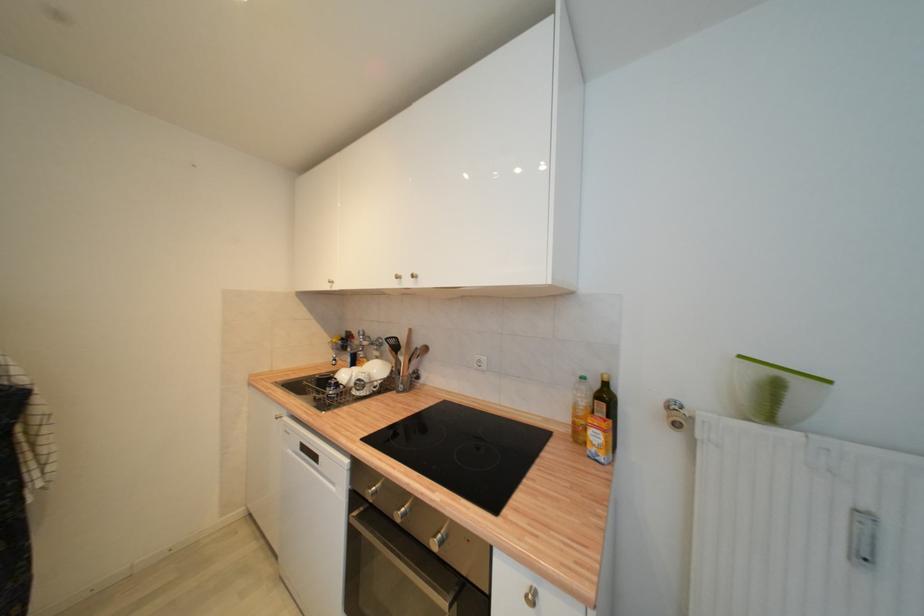
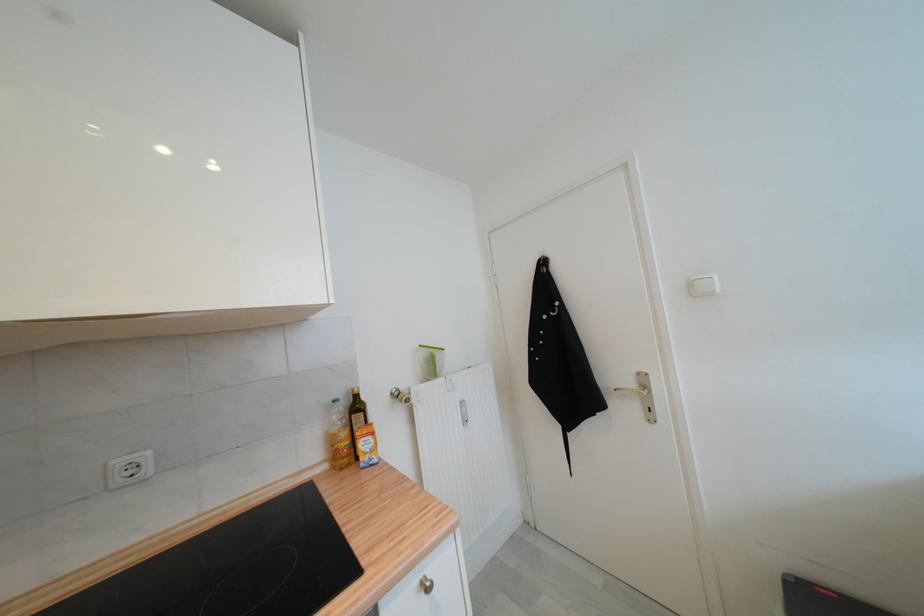
Locate, in the second image, the point that corresponds to (x=482, y=359) in the first image.

(126, 464)